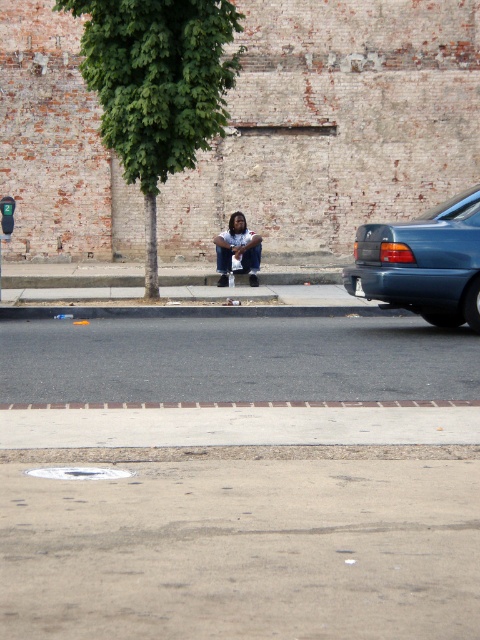
Question: Which point is closer to the camera taking this photo?

Choices:
 (A) (217, 243)
 (B) (282, 326)

Answer: (B)

Question: Does smooth concrete pavement at lower center appear over teal glossy sedan at right?

Choices:
 (A) no
 (B) yes

Answer: (A)

Question: Is teal glossy sedan at right closer to camera compared to dark blue jeans at center?

Choices:
 (A) no
 (B) yes

Answer: (B)

Question: Which object appears closest to the camera in this image?

Choices:
 (A) gray asphalt at center
 (B) smooth concrete pavement at lower center

Answer: (B)

Question: Which of the following is the farthest from the observer?

Choices:
 (A) teal glossy sedan at right
 (B) dark blue jeans at center

Answer: (B)

Question: Does smooth concrete pavement at lower center come in front of gray asphalt at center?

Choices:
 (A) no
 (B) yes

Answer: (B)